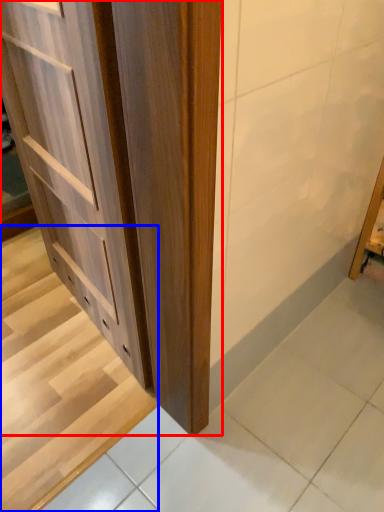
Question: Which object appears closest to the camera in this image, cupboard (highlighted by a red box) or stairwell (highlighted by a blue box)?

Choices:
 (A) cupboard
 (B) stairwell

Answer: (A)